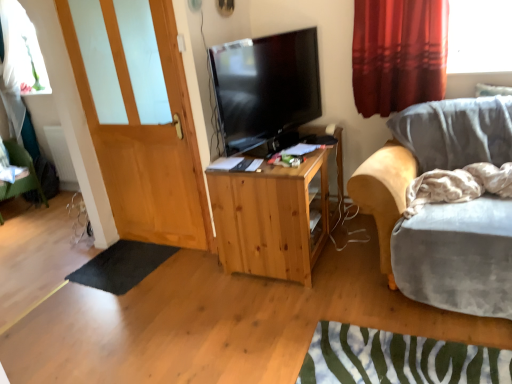
This screenshot has width=512, height=384. What are the coordinates of `vacant area that lies between natural wood cabinet at center and velvet grey chair at right` in the screenshot? It's located at (328, 270).